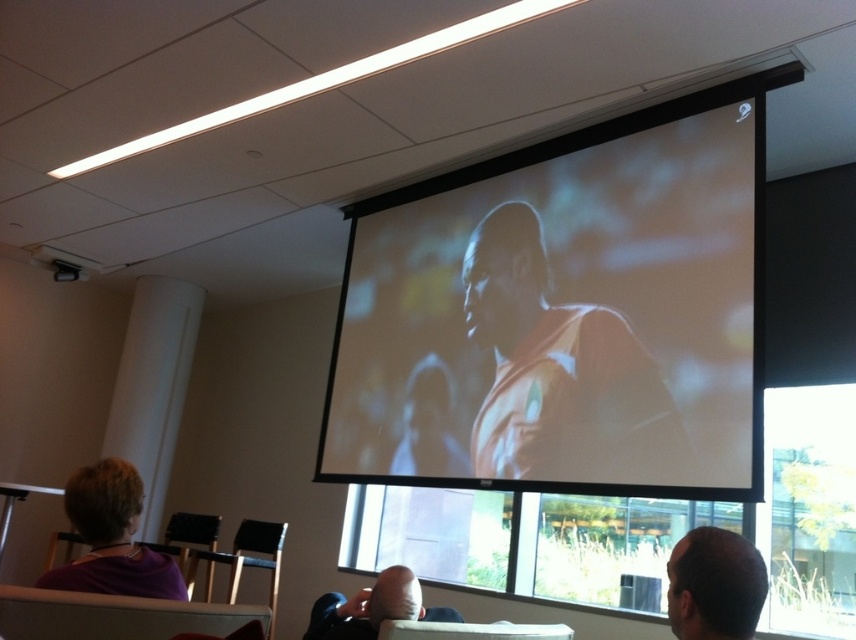
Can you confirm if orange fabric shirt at center is taller than purple fabric at lower left?

Indeed, orange fabric shirt at center has a greater height compared to purple fabric at lower left.

At what (x,y) coordinates should I click in order to perform the action: click on orange fabric shirt at center. Please return your answer as a coordinate pair (x, y). This screenshot has height=640, width=856. Looking at the image, I should click on (559, 372).

Can you confirm if orange fabric screen at center is shorter than smooth bald head at lower right?

No, orange fabric screen at center is not shorter than smooth bald head at lower right.

Is orange fabric screen at center wider than smooth bald head at lower right?

Correct, the width of orange fabric screen at center exceeds that of smooth bald head at lower right.

Where is `orange fabric screen at center`? orange fabric screen at center is located at coordinates (562, 323).

Is orange fabric screen at center wider than orange fabric shirt at center?

Yes.

Find the location of a particular element. The width and height of the screenshot is (856, 640). orange fabric screen at center is located at coordinates (562, 323).

I want to click on orange fabric screen at center, so click(x=562, y=323).